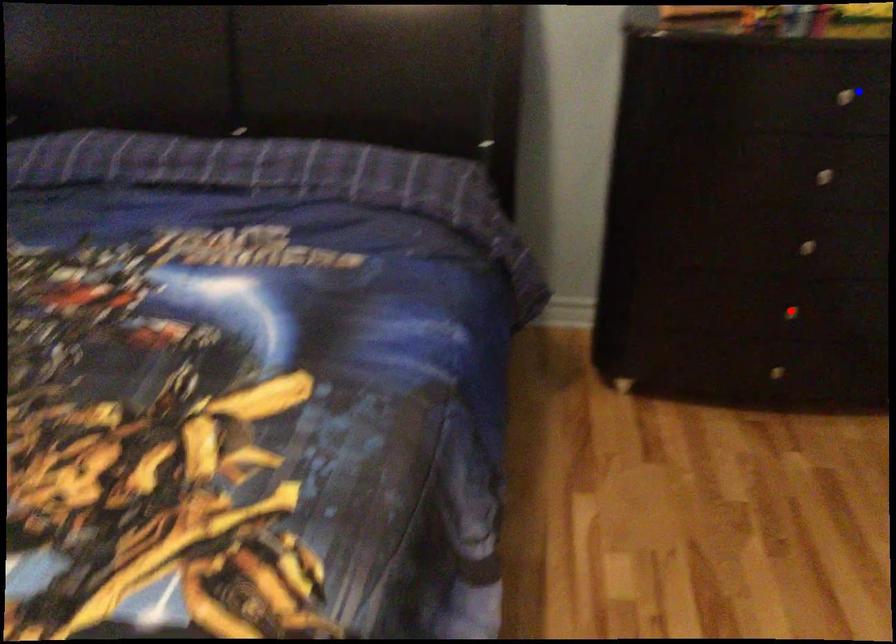
Question: In the image, two points are highlighted. Which point is nearer to the camera? Reply with the corresponding letter.

Choices:
 (A) blue point
 (B) red point

Answer: (A)